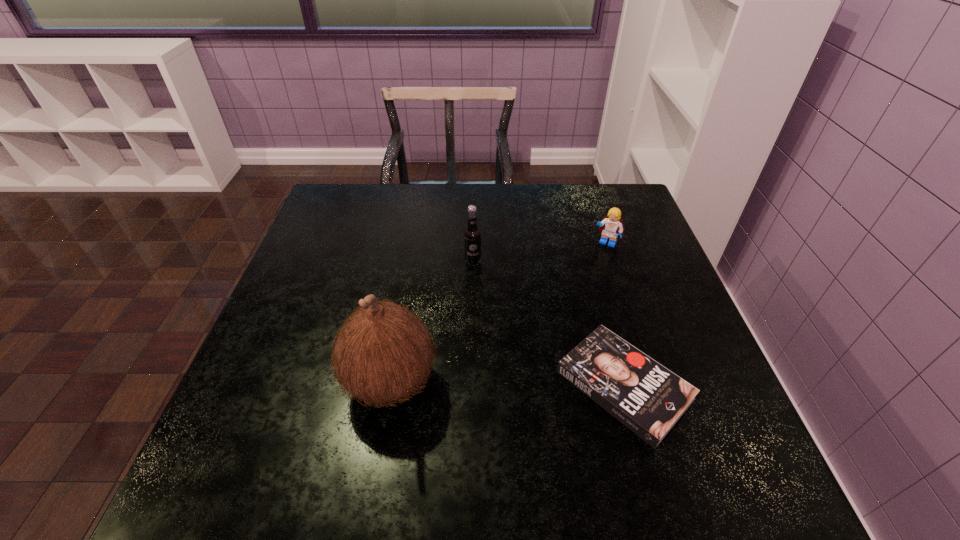
Image resolution: width=960 pixels, height=540 pixels. Identify the location of free space located 0.060m on the back of the shortest object. (604, 314).

I want to click on vacant area situated 0.130m on the label of the second tallest object, so click(486, 302).

Image resolution: width=960 pixels, height=540 pixels. I want to click on vacant space located 0.170m on the label of the second tallest object, so click(490, 314).

This screenshot has width=960, height=540. What are the coordinates of `vacant space located on the label of the second tallest object` in the screenshot? It's located at (512, 387).

Where is `vacant point located on the front-facing side of the Lego`? vacant point located on the front-facing side of the Lego is located at coordinates (589, 268).

Locate an element on the screen. This screenshot has width=960, height=540. vacant space located on the front-facing side of the Lego is located at coordinates (590, 266).

You are a GUI agent. You are given a task and a screenshot of the screen. Output one action in this format:
    pyautogui.click(x=<x>, y=<y>)
    Task: Click on the vacant space positioned on the front-facing side of the Lego
    Image resolution: width=960 pixels, height=540 pixels.
    Given the screenshot: What is the action you would take?
    pyautogui.click(x=541, y=350)

Image resolution: width=960 pixels, height=540 pixels. Find the location of `coconut that is at the near edge`. coconut that is at the near edge is located at coordinates coord(383,353).

The height and width of the screenshot is (540, 960). In order to click on book located at the near edge in this screenshot , I will do `click(645, 396)`.

Locate an element on the screen. This screenshot has height=540, width=960. book positioned at the right edge is located at coordinates (645, 396).